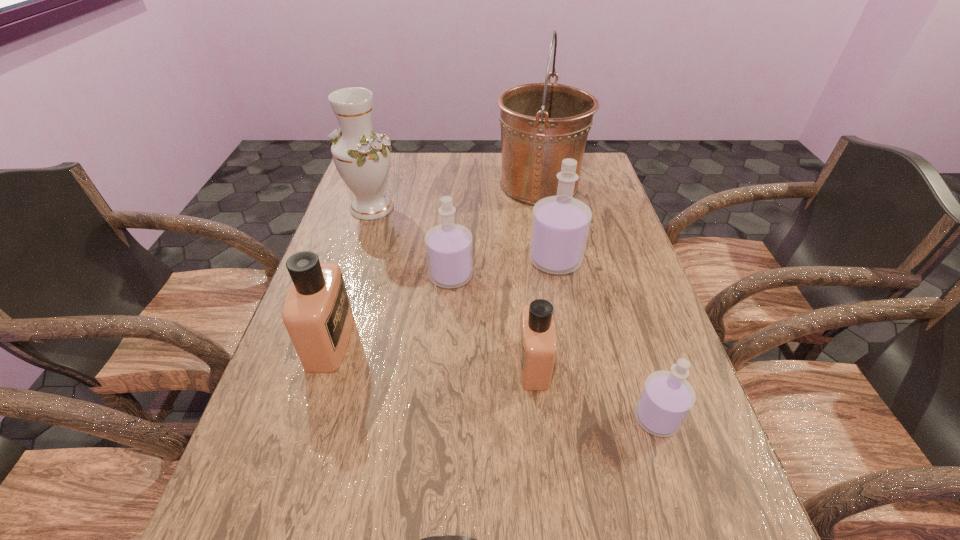
Find the location of a particular element. object located at the far edge is located at coordinates (542, 124).

Image resolution: width=960 pixels, height=540 pixels. What are the coordinates of `vase that is at the left edge` in the screenshot? It's located at (362, 157).

The width and height of the screenshot is (960, 540). I want to click on perfume that is at the left edge, so click(x=317, y=314).

Locate an element on the screen. bucket that is at the right edge is located at coordinates (542, 124).

In order to click on object that is positioned at the far right corner in this screenshot , I will do pos(542,124).

This screenshot has width=960, height=540. In order to click on free spot at the far edge of the desktop in this screenshot , I will do `click(472, 162)`.

Identify the location of vacant space at the left edge. The image size is (960, 540). (298, 490).

At what (x,y) coordinates should I click in order to perform the action: click on free spot at the right edge of the desktop. Please return your answer as a coordinate pair (x, y). The width and height of the screenshot is (960, 540). Looking at the image, I should click on (623, 314).

Where is `vacant space at the far left corner of the desktop`? vacant space at the far left corner of the desktop is located at coordinates (406, 153).

Find the location of a particular element. This screenshot has width=960, height=540. empty space that is in between the rightmost perfume and the right beige perfume is located at coordinates (595, 392).